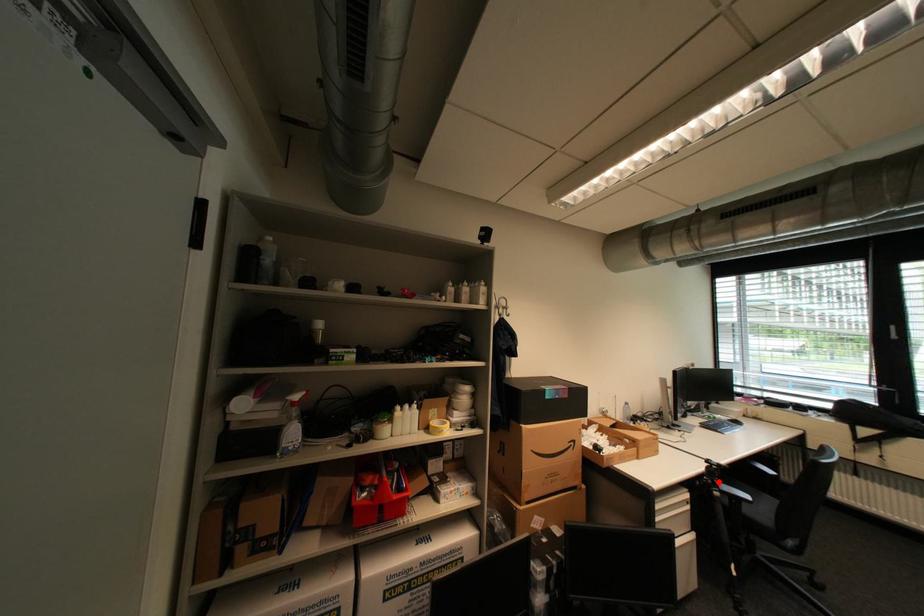
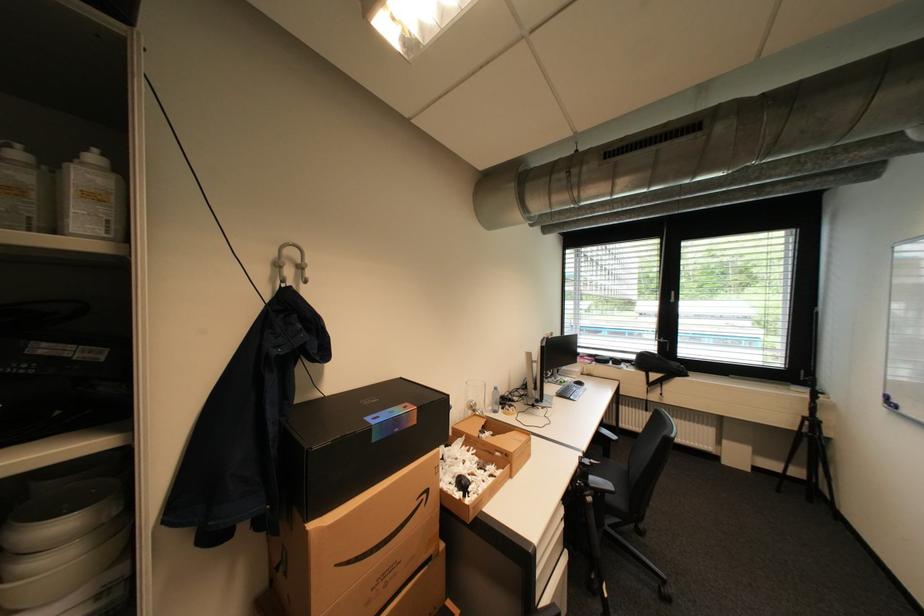
The point at the highlighted location is marked in the first image. Where is the corresponding point in the second image?

(591, 485)